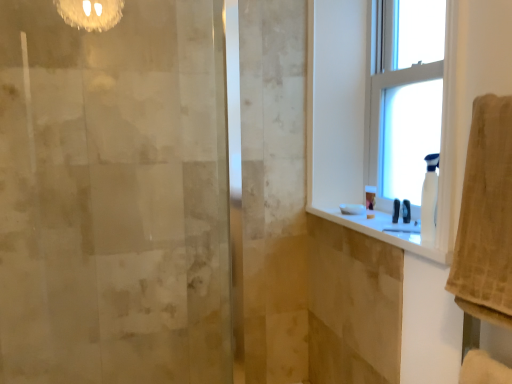
Question: Does white plastic spray bottle at right have a smaller size compared to clear glass window at upper right, the first window from the right?

Choices:
 (A) yes
 (B) no

Answer: (A)

Question: Considering the relative positions of white plastic spray bottle at right and clear glass window at upper right, the 2th window when ordered from left to right, in the image provided, is white plastic spray bottle at right in front of clear glass window at upper right, the 2th window when ordered from left to right,?

Choices:
 (A) no
 (B) yes

Answer: (B)

Question: From a real-world perspective, is white plastic spray bottle at right physically below clear glass window at upper right, the 2th window when ordered from left to right?

Choices:
 (A) yes
 (B) no

Answer: (A)

Question: Is white plastic spray bottle at right further to camera compared to clear glass window at upper right, the first window from the right?

Choices:
 (A) no
 (B) yes

Answer: (A)

Question: Is white plastic spray bottle at right taller than clear glass window at upper right, the first window from the right?

Choices:
 (A) no
 (B) yes

Answer: (A)

Question: Does white plastic spray bottle at right have a larger size compared to clear glass window at upper right, the first window from the right?

Choices:
 (A) no
 (B) yes

Answer: (A)

Question: Is beige textured towel at right positioned beyond the bounds of clear glass window at upper right, the 2th window when ordered from left to right?

Choices:
 (A) yes
 (B) no

Answer: (A)

Question: From a real-world perspective, is beige textured towel at right below clear glass window at upper right, the first window from the right?

Choices:
 (A) no
 (B) yes

Answer: (B)

Question: Is beige textured towel at right turned away from clear glass window at upper right, the first window from the right?

Choices:
 (A) no
 (B) yes

Answer: (A)

Question: Could you tell me if beige textured towel at right is facing clear glass window at upper right, the 2th window when ordered from left to right?

Choices:
 (A) yes
 (B) no

Answer: (B)

Question: Considering the relative sizes of beige textured towel at right and clear glass window at upper right, the 2th window when ordered from left to right, in the image provided, is beige textured towel at right wider than clear glass window at upper right, the 2th window when ordered from left to right,?

Choices:
 (A) no
 (B) yes

Answer: (B)

Question: Is beige textured towel at right behind clear glass window at upper right, the 2th window when ordered from left to right?

Choices:
 (A) yes
 (B) no

Answer: (B)

Question: Can we say beige textured towel at right lies outside white glossy counter top at upper right?

Choices:
 (A) yes
 (B) no

Answer: (A)